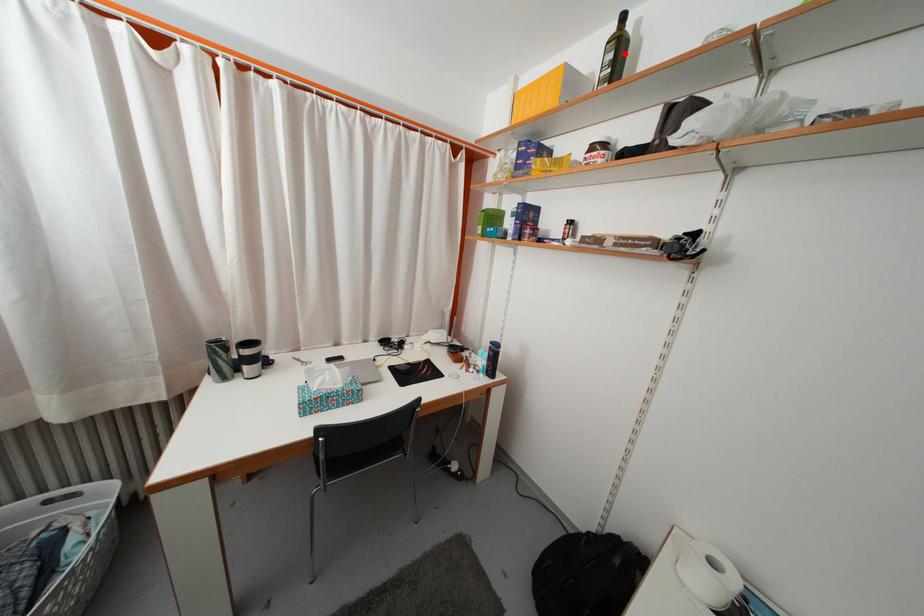
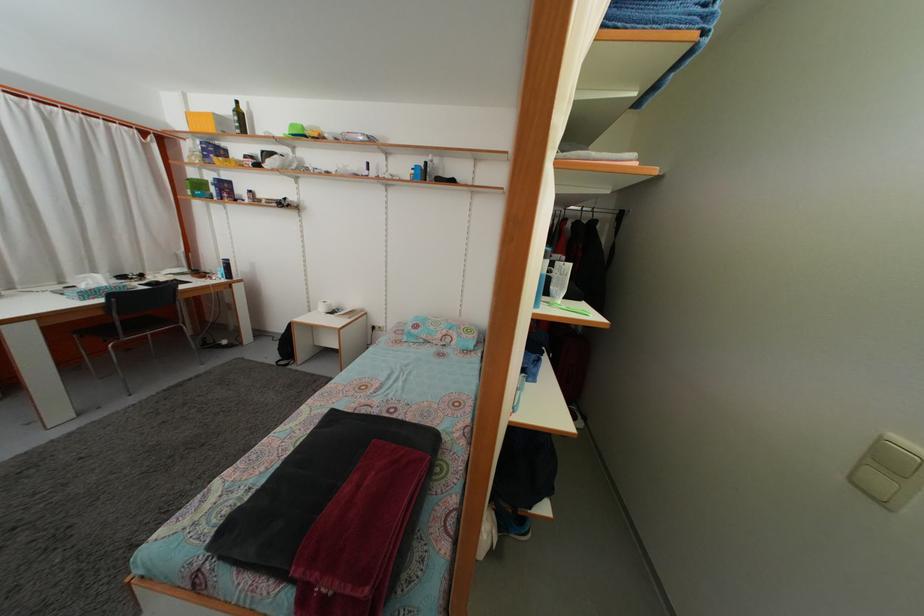
In the second image, find the point that corresponds to the highlighted location in the first image.

(246, 122)